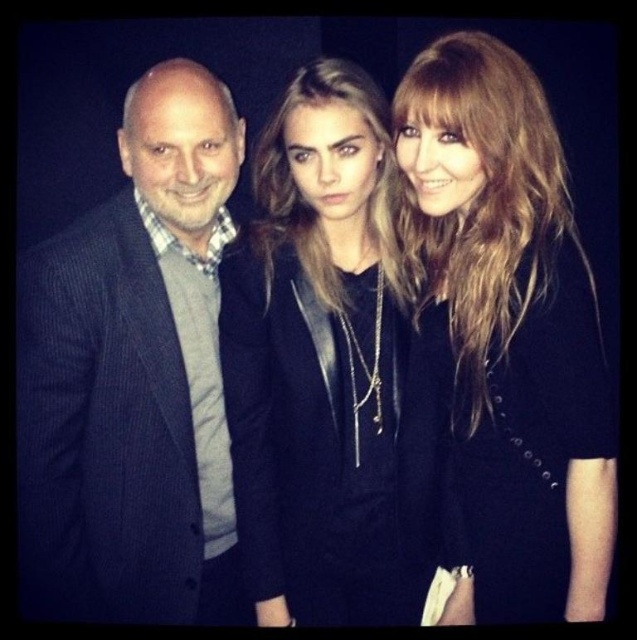
You are a photographer setting up for a group photo. You notice the dark pinstriped suit at left and the black leather jacket at center. Which piece of clothing should you adjust the lighting to highlight more, considering their sizes?

The dark pinstriped suit at left is taller than the black leather jacket at center, so you should adjust the lighting to highlight the dark pinstriped suit at left more due to its larger size.

You are standing in front of the image and want to know the exact location of the shiny black coat at center. Can you tell me its coordinates?

The shiny black coat at center is located at coordinates point (505, 337).

You are a photographer setting up for a group photo. You have a 18 inch wide camera tripod. You need to place it between the dark pinstriped suit at left and the shiny black coat at center. Is there enough space between them to fit the tripod?

The dark pinstriped suit at left is 21.06 inches from the shiny black coat at center. Since the tripod is 18 inches wide, there is enough space between them to fit the tripod.